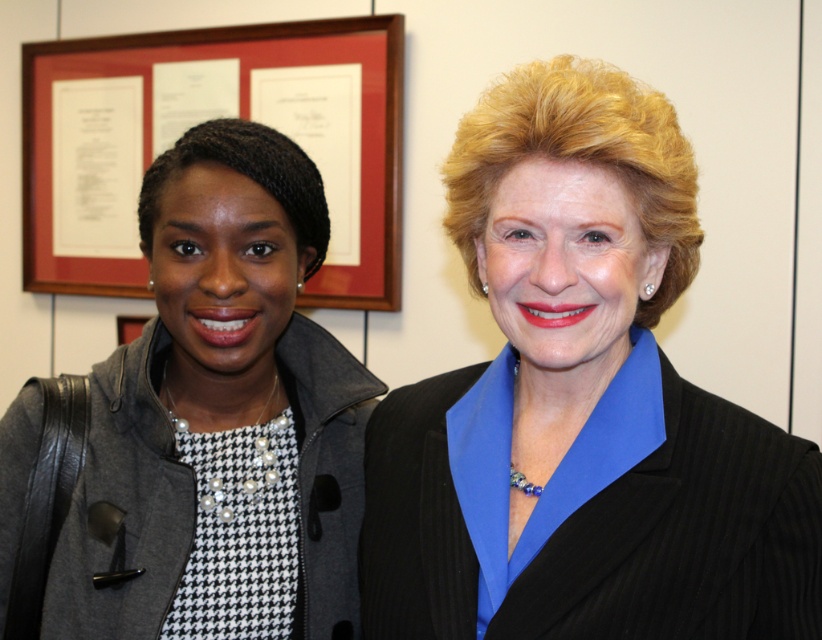
You are an interior designer organizing a gallery wall. You have the matte black jacket at left and the wooden frame at upper left. Which object should you place on the right side of the gallery wall to maintain the existing spatial relationship?

You should place the matte black jacket at left on the right side of the gallery wall because it is already positioned to the right of the wooden frame at upper left in the original scene.

You are a photographer setting up for a group photo. You need to ensure that the two black garments in the scene, the matte black blazer at center and the matte black jacket at left, are at least 10 inches apart to avoid overlapping in the photo. Based on the current positioning, will you need to adjust their positions?

The matte black blazer at center is only 9.69 inches from the matte black jacket at left, which is less than the required 10 inches. To prevent overlapping, you should adjust their positions to increase the distance between them.

You are taking a photo of the two people in the scene. To ensure the matte black jacket at left and the wooden frame at upper left are both clearly visible in the shot, which object should you focus on first?

You should focus on the matte black jacket at left first because it is in front of the wooden frame at upper left, so focusing on it will keep both objects in focus.